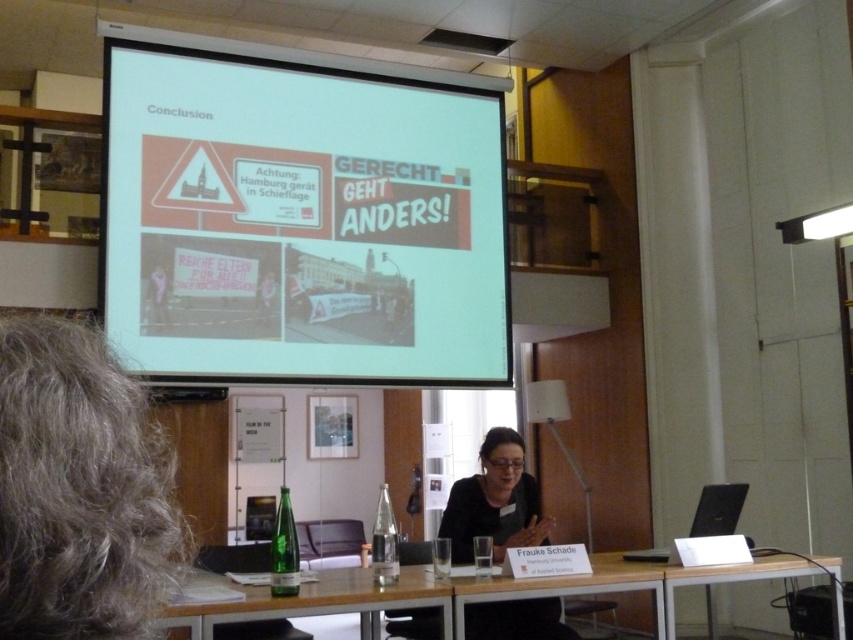
Question: Which of the following is the closest to the observer?

Choices:
 (A) white glossy projector screen at upper center
 (B) green glass bottle at lower center
 (C) white plastic table at lower right

Answer: (B)

Question: Does white plastic table at lower center have a smaller size compared to black fabric at center?

Choices:
 (A) no
 (B) yes

Answer: (A)

Question: Which of these objects is positioned closest to the white glossy projector screen at upper center?

Choices:
 (A) green glass bottle at lower center
 (B) black fabric at center
 (C) white plastic table at lower right

Answer: (B)

Question: Among these objects, which one is farthest from the camera?

Choices:
 (A) white plastic table at lower right
 (B) black fabric at center
 (C) green glass bottle at lower center
 (D) black plastic laptop at lower right

Answer: (D)

Question: Does white glossy projector screen at upper center appear on the left side of white plastic table at lower right?

Choices:
 (A) no
 (B) yes

Answer: (B)

Question: Observing the image, what is the correct spatial positioning of black fabric at center in reference to black plastic laptop at lower right?

Choices:
 (A) above
 (B) below

Answer: (A)